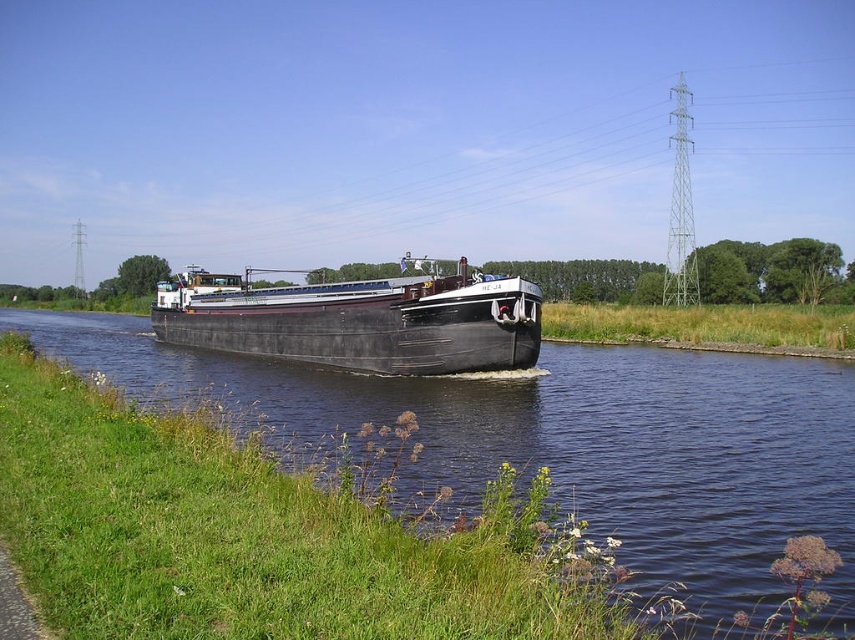
Question: Can you confirm if black rubber boat at center is wider than matte black barge at center?

Choices:
 (A) no
 (B) yes

Answer: (B)

Question: Can you confirm if black rubber boat at center is thinner than matte black barge at center?

Choices:
 (A) no
 (B) yes

Answer: (A)

Question: Which point is closer to the camera taking this photo?

Choices:
 (A) (676, 392)
 (B) (429, 326)

Answer: (A)

Question: Is black rubber boat at center to the right of matte black barge at center from the viewer's perspective?

Choices:
 (A) yes
 (B) no

Answer: (A)

Question: Which point is farther to the camera?

Choices:
 (A) [485, 339]
 (B) [517, 436]

Answer: (A)